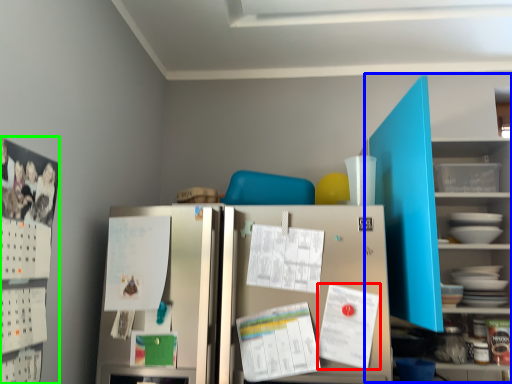
Question: Which object is the farthest from paper (highlighted by a red box)? Choose among these: bookshelf (highlighted by a blue box) or bulletin board (highlighted by a green box).

Choices:
 (A) bookshelf
 (B) bulletin board

Answer: (B)